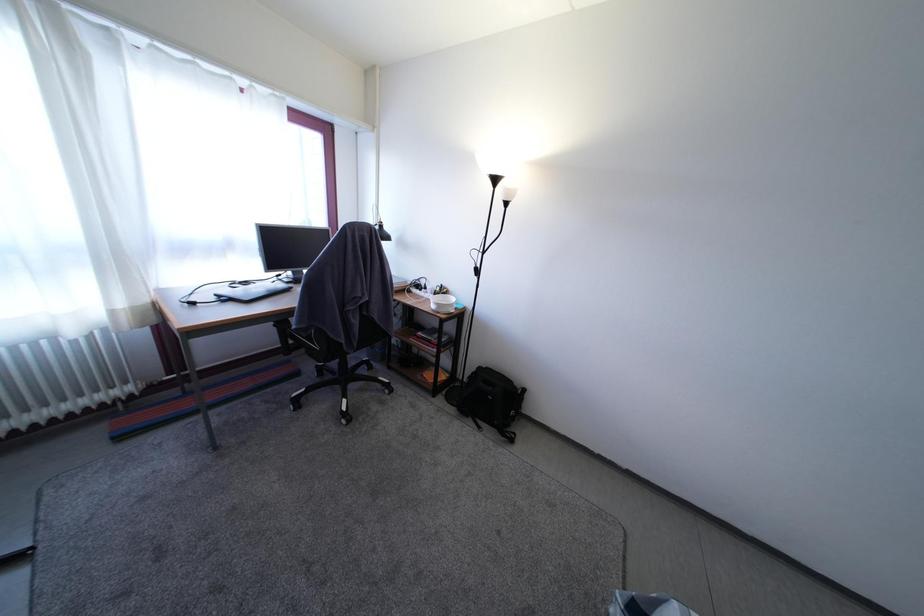
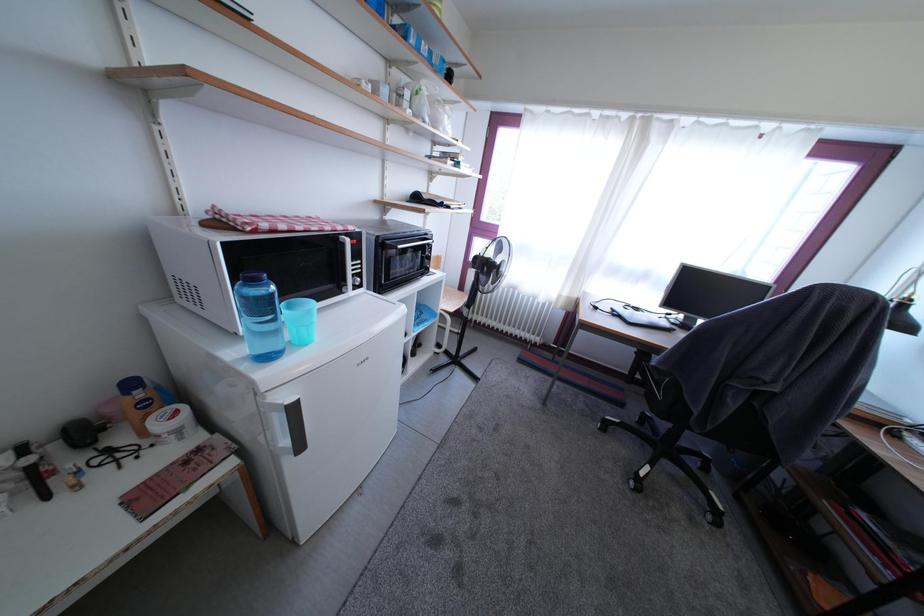
Question: The camera is either moving clockwise (left) or counter-clockwise (right) around the object. The first image is from the beginning of the video and the second image is from the end. Is the camera moving left or right when shooting the video?

Choices:
 (A) Left
 (B) Right

Answer: (B)